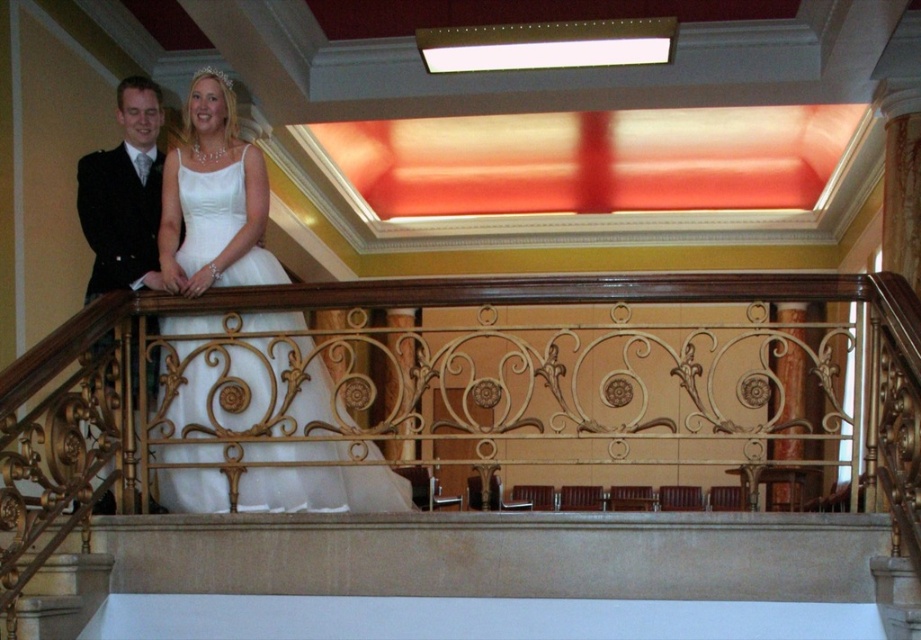
Question: Does white satin dress at center come in front of black satin suit at left?

Choices:
 (A) no
 (B) yes

Answer: (B)

Question: Which point is farther to the camera?

Choices:
 (A) white satin dress at center
 (B) black satin suit at left

Answer: (B)

Question: Can you confirm if white satin dress at center is bigger than black satin suit at left?

Choices:
 (A) no
 (B) yes

Answer: (B)

Question: Which object appears closest to the camera in this image?

Choices:
 (A) white satin dress at center
 (B) black satin suit at left

Answer: (A)

Question: Is white satin dress at center thinner than black satin suit at left?

Choices:
 (A) no
 (B) yes

Answer: (A)